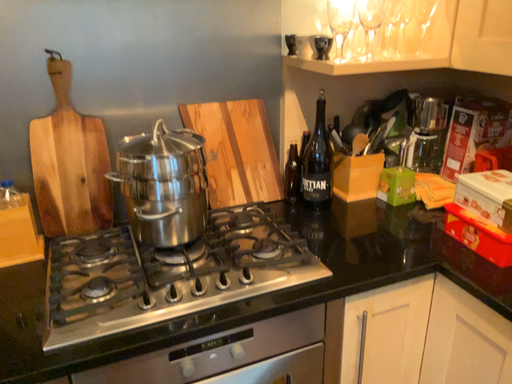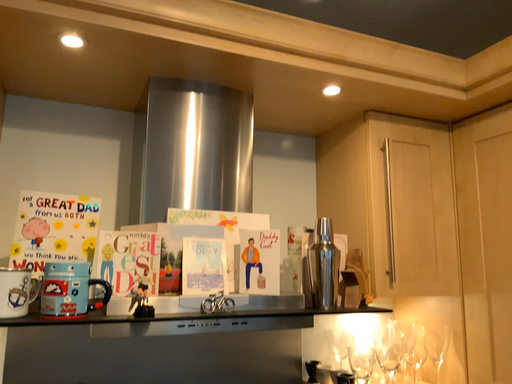
Question: How did the camera likely rotate when shooting the video?

Choices:
 (A) rotated upward
 (B) rotated downward

Answer: (A)